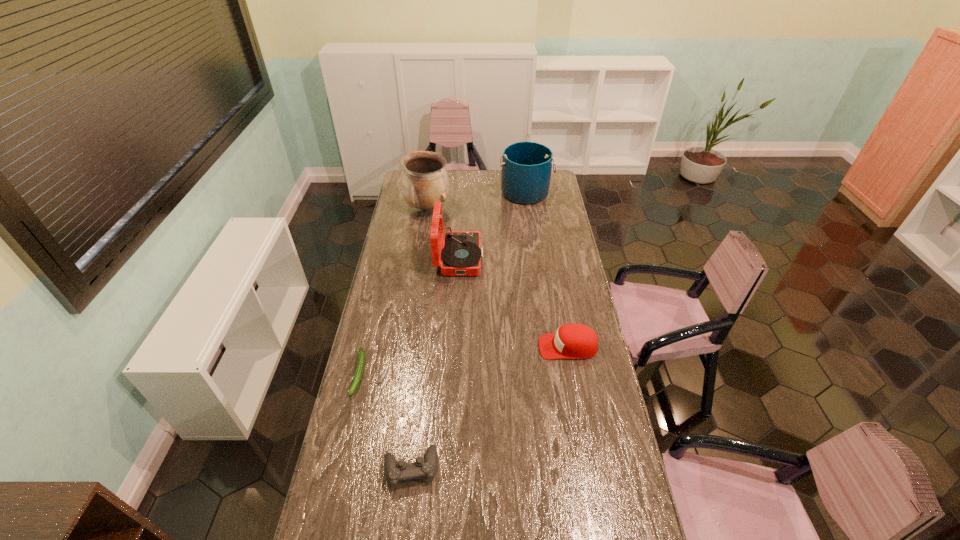
Where is `free space located 0.400m on the front-facing side of the phonograph_record`? This screenshot has height=540, width=960. free space located 0.400m on the front-facing side of the phonograph_record is located at coordinates (564, 258).

Locate an element on the screen. This screenshot has width=960, height=540. blank space located on the front-facing side of the baseball cap is located at coordinates (461, 347).

At what (x,y) coordinates should I click in order to perform the action: click on free spot located 0.270m on the front-facing side of the baseball cap. Please return your answer as a coordinate pair (x, y). The height and width of the screenshot is (540, 960). Looking at the image, I should click on (471, 347).

Locate an element on the screen. This screenshot has height=540, width=960. vacant space located on the front-facing side of the baseball cap is located at coordinates (501, 347).

Identify the location of blank space located on the back of the nearest object. This screenshot has width=960, height=540. (424, 352).

The height and width of the screenshot is (540, 960). Identify the location of vacant space situated on the front-facing side of the leftmost object. point(326,511).

Locate an element on the screen. The width and height of the screenshot is (960, 540). object situated at the far edge is located at coordinates (526, 166).

Locate an element on the screen. The image size is (960, 540). urn present at the left edge is located at coordinates (425, 181).

This screenshot has height=540, width=960. Identify the location of control present at the left edge. (396, 472).

The width and height of the screenshot is (960, 540). In order to click on zucchini present at the left edge in this screenshot , I will do `click(361, 354)`.